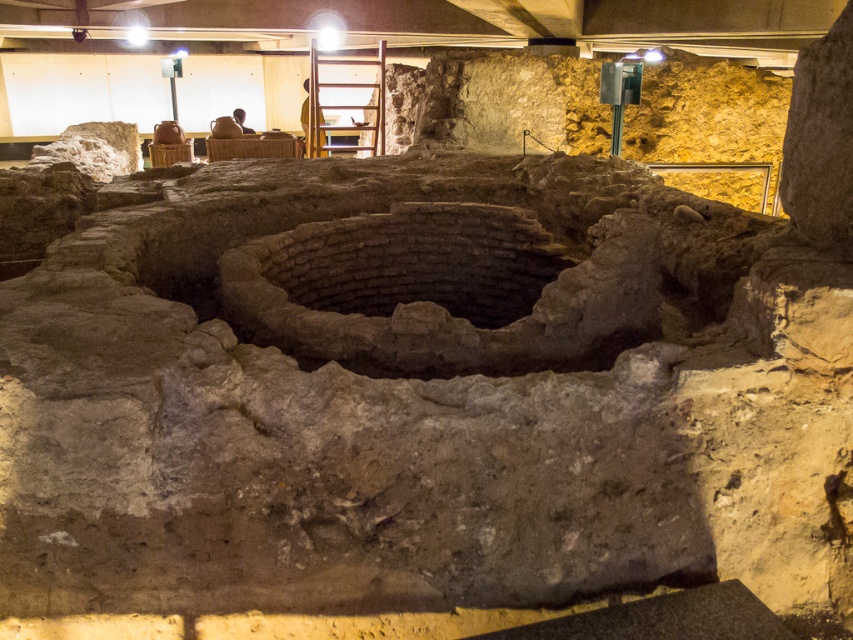
You are an archaeologist standing at the edge of the excavation site. You need to reach the wooden ladder at upper center to exit the pit. The brown textured stone well at center is blocking your path. Can you walk around the well to reach the ladder?

The brown textured stone well at center is 5.41 meters away from wooden ladder at upper center. Since the well is blocking the direct path, you can walk around it to reach the ladder as there is enough space between them.

You are standing at the excavation site and want to reach the point marked at coordinates (538, 225). If your current position is 19.95 feet away from that point, can you estimate how far you need to walk to get there?

The point marked at coordinates (538, 225) is 19.95 feet away from your current position, so you need to walk approximately 19.95 feet to reach it.

You are an archaeologist at the excavation site and need to place the matte brown vase at upper center next to the wooden ladder at upper center. Given the space constraints, will the vase fit beside the ladder without overlapping?

The wooden ladder at upper center is wider than the matte brown vase at upper center. Since the ladder is wider, there should be enough space to place the vase beside it without overlapping, as the vase is narrower.